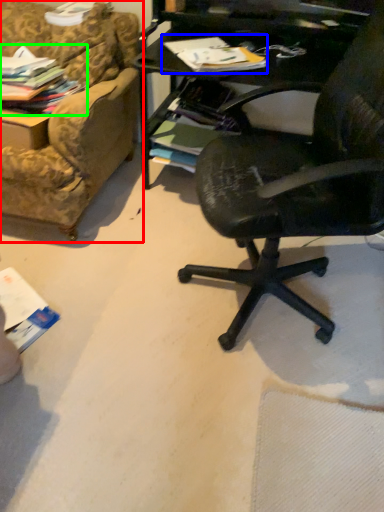
Question: Estimate the real-world distances between objects in this image. Which object is closer to studio couch (highlighted by a red box), magazine (highlighted by a blue box) or magazine (highlighted by a green box)?

Choices:
 (A) magazine
 (B) magazine

Answer: (B)